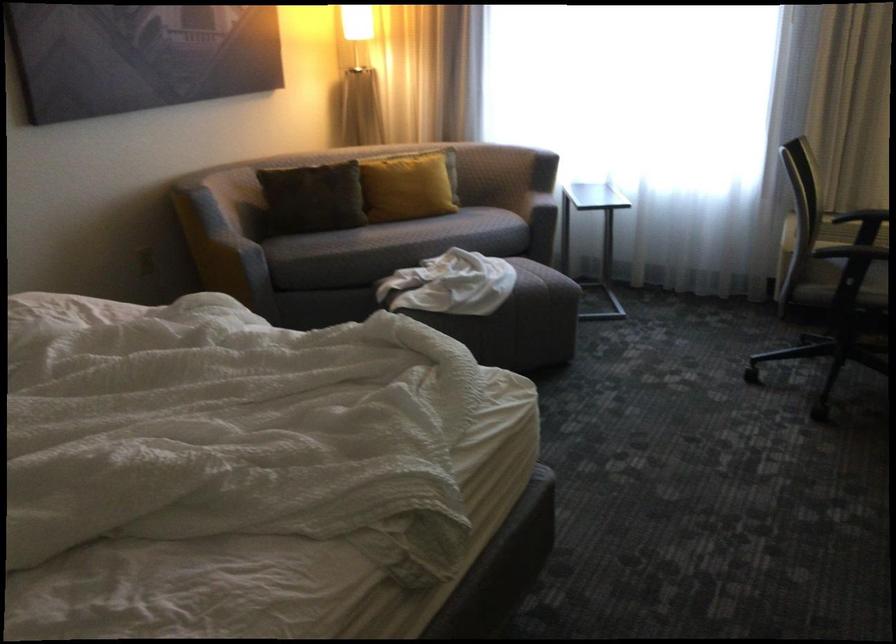
Where would you lean the gray sofa armrest? Please return your answer as a coordinate pair (x, y).

(538, 194)